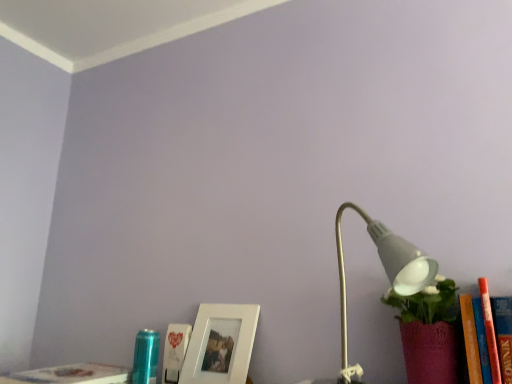
Question: In terms of height, does white matte picture frame at lower center look taller or shorter compared to white matte lamp at right?

Choices:
 (A) short
 (B) tall

Answer: (A)

Question: From a real-world perspective, is white matte picture frame at lower center above or below white matte lamp at right?

Choices:
 (A) below
 (B) above

Answer: (A)

Question: Which is farther from the white matte lamp at right?

Choices:
 (A) white paper at lower center, acting as the second book starting from the left
 (B) white matte picture frame at lower center
 (C) hardcover book at lower left, the 1th book in the left-to-right sequence

Answer: (C)

Question: Which object is positioned closest to the white matte picture frame at lower center?

Choices:
 (A) hardcover book at lower left, the 1th book in the left-to-right sequence
 (B) white matte lamp at right
 (C) white paper at lower center, which ranks as the first book in right-to-left order

Answer: (C)